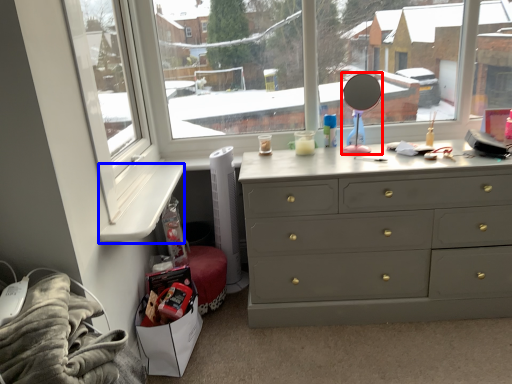
Question: Among these objects, which one is farthest to the camera, mirror (highlighted by a red box) or window sill (highlighted by a blue box)?

Choices:
 (A) mirror
 (B) window sill

Answer: (A)